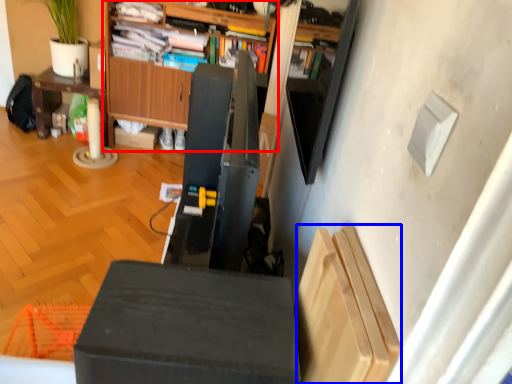
Question: Among these objects, which one is nearest to the camera, cabinetry (highlighted by a red box) or shelf (highlighted by a blue box)?

Choices:
 (A) cabinetry
 (B) shelf

Answer: (B)